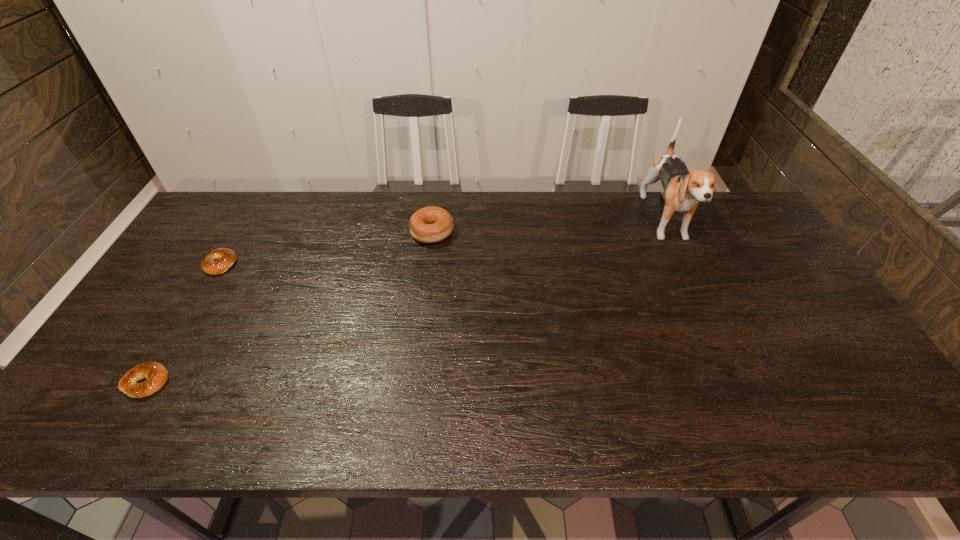
You are a GUI agent. You are given a task and a screenshot of the screen. Output one action in this format:
    pyautogui.click(x=<x>, y=<y>)
    Task: Click on the free point between the second farthest bagel and the nearest object
    
    Given the screenshot: What is the action you would take?
    pyautogui.click(x=183, y=323)

The height and width of the screenshot is (540, 960). Identify the location of empty space between the nearest object and the second nearest bagel. (183, 323).

Image resolution: width=960 pixels, height=540 pixels. What are the coordinates of `vacant region between the second farthest bagel and the puppy` in the screenshot? It's located at (444, 243).

The width and height of the screenshot is (960, 540). What are the coordinates of `vacant space that's between the second farthest bagel and the rightmost bagel` in the screenshot? It's located at (326, 248).

Where is `vacant space that's between the second object from right to left and the second farthest bagel`? The height and width of the screenshot is (540, 960). vacant space that's between the second object from right to left and the second farthest bagel is located at coordinates (326, 248).

At what (x,y) coordinates should I click in order to perform the action: click on free space between the second nearest bagel and the nearest bagel. Please return your answer as a coordinate pair (x, y). This screenshot has width=960, height=540. Looking at the image, I should click on (183, 323).

Identify the location of vacant area that lies between the rightmost bagel and the second nearest bagel. This screenshot has width=960, height=540. click(x=326, y=248).

At what (x,y) coordinates should I click in order to perform the action: click on empty location between the second farthest bagel and the puppy. Please return your answer as a coordinate pair (x, y). Looking at the image, I should click on (444, 243).

Locate which object is the closest to the second nearest bagel. Please provide its 2D coordinates. Your answer should be formatted as a tuple, i.e. [(x, y)], where the tuple contains the x and y coordinates of a point satisfying the conditions above.

[(156, 374)]

Identify which object is the second closest to the second nearest bagel. Please provide its 2D coordinates. Your answer should be formatted as a tuple, i.e. [(x, y)], where the tuple contains the x and y coordinates of a point satisfying the conditions above.

[(432, 224)]